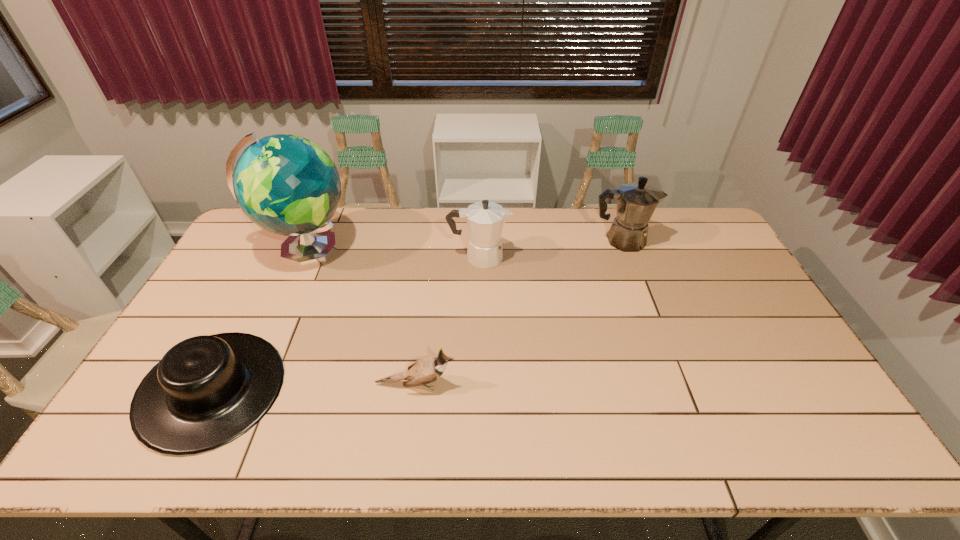
The width and height of the screenshot is (960, 540). What are the coordinates of `globe` in the screenshot? It's located at (287, 185).

Find the location of a particular element. This screenshot has height=540, width=960. the right coffeepot is located at coordinates (636, 202).

This screenshot has height=540, width=960. Find the location of `the left coffeepot`. the left coffeepot is located at coordinates 485,219.

Locate an element on the screen. bird is located at coordinates (424, 371).

Where is `dress hat`? This screenshot has height=540, width=960. dress hat is located at coordinates (206, 391).

Image resolution: width=960 pixels, height=540 pixels. I want to click on vacant position located on the front surface of the globe, so click(x=425, y=250).

The width and height of the screenshot is (960, 540). What are the coordinates of `vacant space located on the pouring side of the rightmost object` in the screenshot? It's located at (695, 240).

Find the location of `vacant area situated 0.360m at the spout of the left coffeepot`. vacant area situated 0.360m at the spout of the left coffeepot is located at coordinates (614, 257).

Where is `free space located at the face of the bird`? free space located at the face of the bird is located at coordinates (548, 384).

This screenshot has height=540, width=960. Find the location of `vacant area located on the right of the dress hat`. vacant area located on the right of the dress hat is located at coordinates point(432,390).